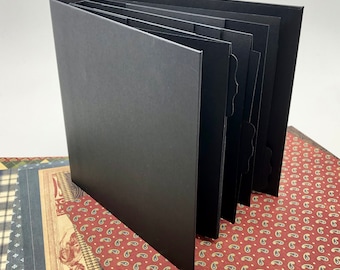
What are the coordinates of `folder` in the screenshot? It's located at (179, 96).